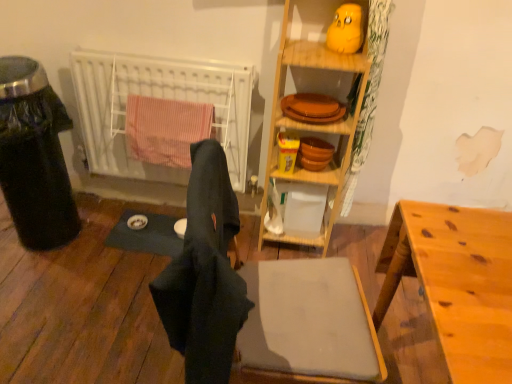
Question: Considering the positions of point (104, 76) and point (315, 21), is point (104, 76) closer or farther from the camera than point (315, 21)?

Choices:
 (A) farther
 (B) closer

Answer: (A)

Question: From their relative heights in the image, would you say white matte radiator at left is taller or shorter than wooden shelf at upper center?

Choices:
 (A) short
 (B) tall

Answer: (A)

Question: Which is farther from the light brown wooden desk at lower right?

Choices:
 (A) orange matte tray at center
 (B) dark fabric laundry at center
 (C) transparent plastic trash can at left
 (D) white matte radiator at left
 (E) matte orange plates at upper center

Answer: (C)

Question: Which object is the farthest from the wooden shelf at upper center?

Choices:
 (A) white matte radiator at left
 (B) dark fabric laundry at center
 (C) matte orange plates at upper center
 (D) light brown wooden desk at lower right
 (E) orange matte tray at center

Answer: (B)